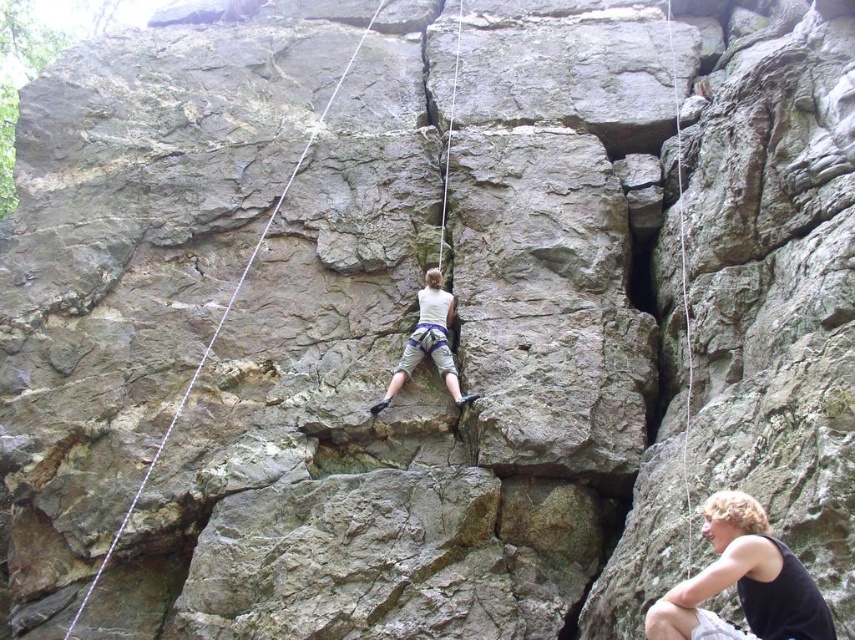
Does point (730, 560) come behind point (326, 106)?

No, (730, 560) is closer to viewer.

Does matte white tank top at center have a lesser width compared to gray/rough rope at center?

Yes, matte white tank top at center is thinner than gray/rough rope at center.

Describe the element at coordinates (741, 582) in the screenshot. I see `matte white tank top at center` at that location.

Where is `matte white tank top at center`? This screenshot has height=640, width=855. matte white tank top at center is located at coordinates (741, 582).

How distant is white fabric climbing harness at center from white nylon rope at upper center?

A distance of 18.51 meters exists between white fabric climbing harness at center and white nylon rope at upper center.

Measure the distance between white fabric climbing harness at center and camera.

white fabric climbing harness at center and camera are 56.04 meters apart from each other.

Does point (447, 372) come closer to viewer compared to point (684, 266)?

Yes, it is.

Image resolution: width=855 pixels, height=640 pixels. I want to click on white fabric climbing harness at center, so click(x=428, y=342).

Is point (730, 632) closer to camera compared to point (681, 172)?

Yes, it is in front of point (681, 172).

Is matte white tank top at center above white nylon rope at upper center?

No, matte white tank top at center is not above white nylon rope at upper center.

The width and height of the screenshot is (855, 640). Describe the element at coordinates (741, 582) in the screenshot. I see `matte white tank top at center` at that location.

Identify the location of matte white tank top at center. The height and width of the screenshot is (640, 855). (741, 582).